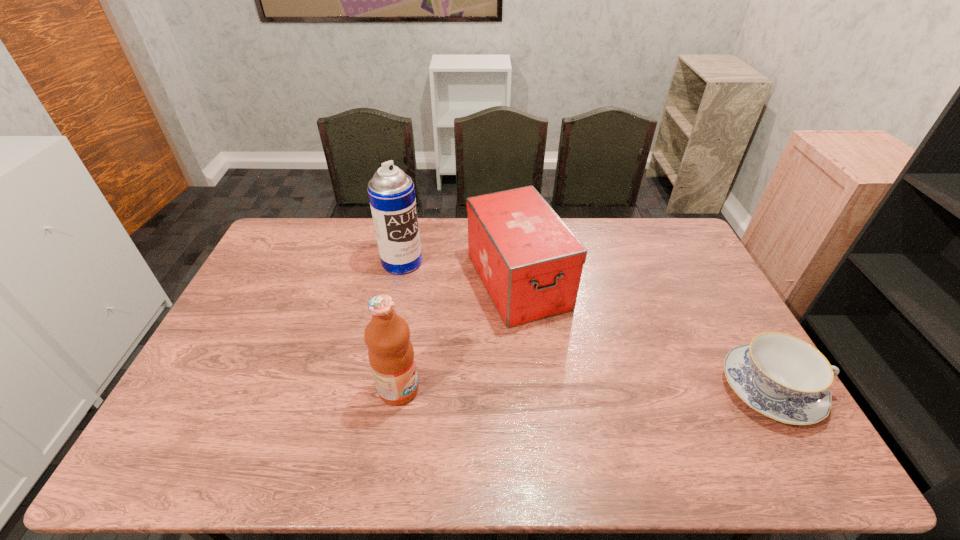
You are a GUI agent. You are given a task and a screenshot of the screen. Output one action in this format:
    pyautogui.click(x=<x>, y=<y>)
    Task: Click on the second tallest object
    
    Given the screenshot: What is the action you would take?
    pyautogui.click(x=391, y=355)

The image size is (960, 540). I want to click on the shortest object, so click(x=783, y=377).

You are a GUI agent. You are given a task and a screenshot of the screen. Output one action in this format:
    pyautogui.click(x=<x>, y=<y>)
    Task: Click on the chinaware
    
    Given the screenshot: What is the action you would take?
    pyautogui.click(x=783, y=377)

Find the location of a particular element. aerosol can is located at coordinates (391, 192).

I want to click on the second shortest object, so click(530, 262).

At what (x,y) coordinates should I click in order to perform the action: click on the first-aid kit. Please return your answer as a coordinate pair (x, y). Looking at the image, I should click on (530, 262).

Where is `vacant space located 0.240m on the front label of the second tallest object`? vacant space located 0.240m on the front label of the second tallest object is located at coordinates (508, 389).

The height and width of the screenshot is (540, 960). I want to click on vacant space located 0.360m on the label side of the aerosol can, so click(492, 323).

This screenshot has width=960, height=540. I want to click on vacant space situated on the label side of the aerosol can, so click(462, 303).

You are a GUI agent. You are given a task and a screenshot of the screen. Output one action in this format:
    pyautogui.click(x=<x>, y=<y>)
    Task: Click on the vacant space located on the label side of the aerosol can
    The image size is (960, 540).
    Given the screenshot: What is the action you would take?
    pyautogui.click(x=439, y=287)